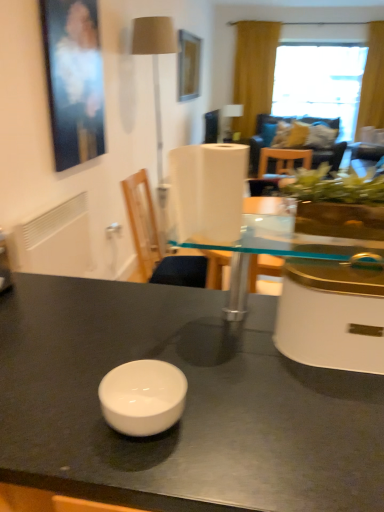
This screenshot has height=512, width=384. In order to click on empty space that is ontop of white glossy bowl at center (from a real-world perspective) in this screenshot , I will do `click(176, 364)`.